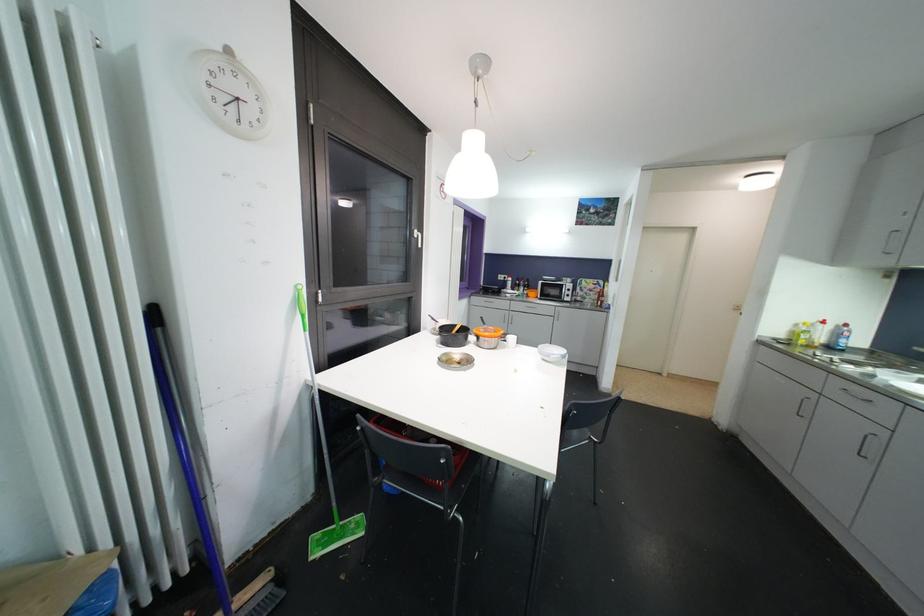
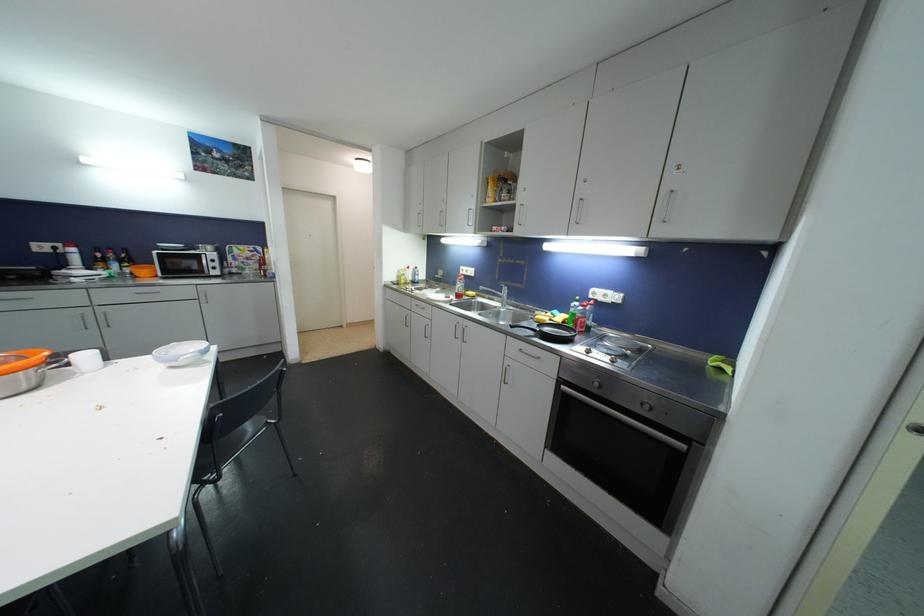
The point at (558,355) is marked in the first image. Where is the corresponding point in the second image?

(195, 354)